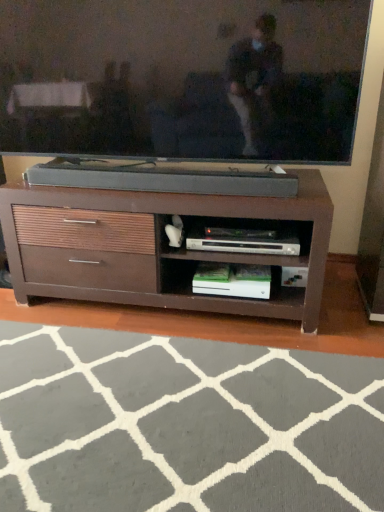
What are the coordinates of `free space above gray soft rug at lower center (from a real-world perspective)` in the screenshot? It's located at (144, 401).